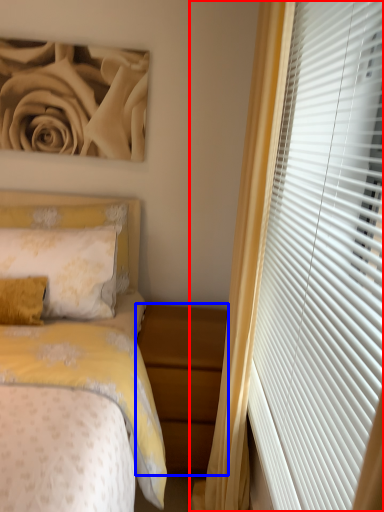
Question: Among these objects, which one is nearest to the camera, curtain (highlighted by a red box) or nightstand (highlighted by a blue box)?

Choices:
 (A) curtain
 (B) nightstand

Answer: (A)